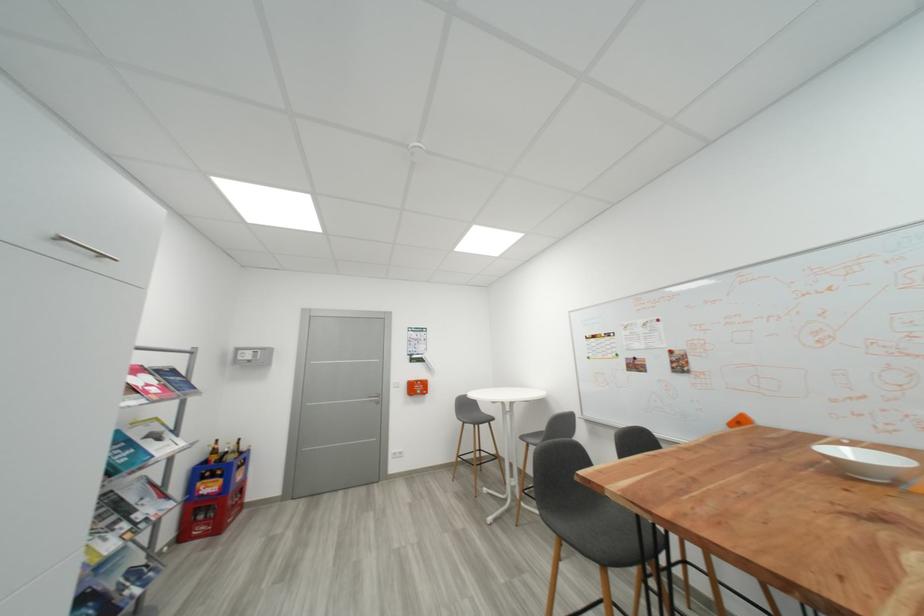
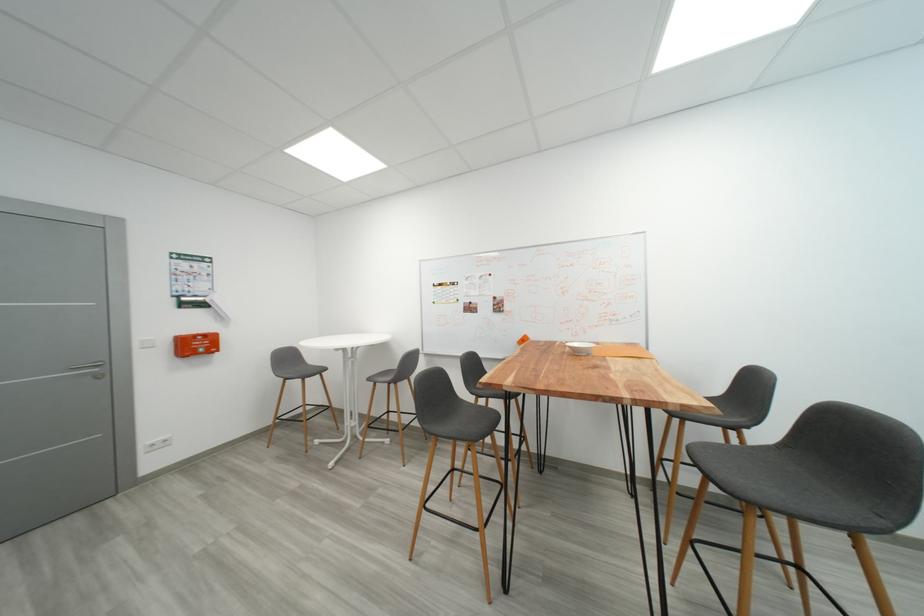
The point at (x=473, y=410) is marked in the first image. Where is the corresponding point in the second image?

(295, 363)